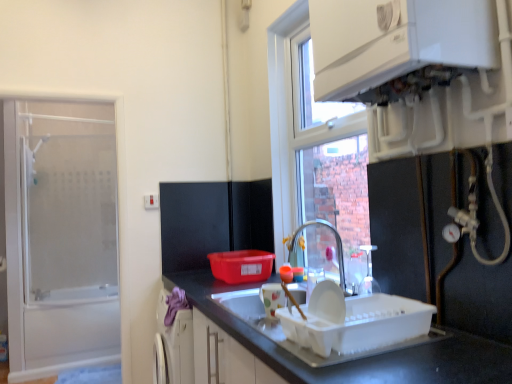
Question: In terms of size, does transparent glass shower door at left appear bigger or smaller than white glossy countertop at lower center?

Choices:
 (A) big
 (B) small

Answer: (B)

Question: From the image's perspective, is transparent glass shower door at left positioned above or below white glossy countertop at lower center?

Choices:
 (A) above
 (B) below

Answer: (A)

Question: Which object is the farthest from the transparent glass shower door at left?

Choices:
 (A) white glossy boiler at upper right
 (B) glossy metallic tap at center
 (C) white glossy countertop at lower center

Answer: (A)

Question: Which object is positioned closest to the glossy metallic tap at center?

Choices:
 (A) white glossy boiler at upper right
 (B) transparent glass shower door at left
 (C) white glossy countertop at lower center

Answer: (C)